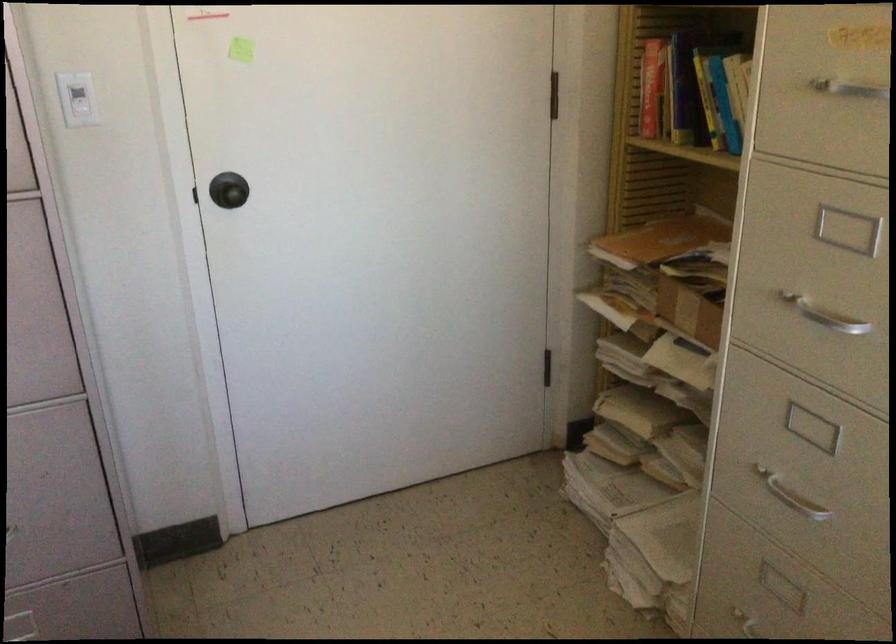
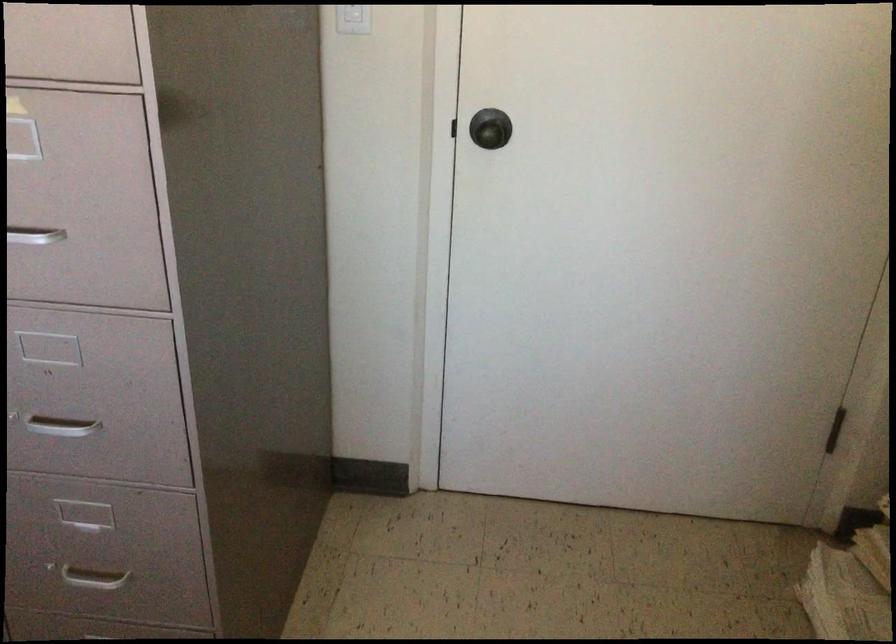
Question: The camera is either moving clockwise (left) or counter-clockwise (right) around the object. The first image is from the beginning of the video and the second image is from the end. Is the camera moving left or right when shooting the video?

Choices:
 (A) Left
 (B) Right

Answer: (B)